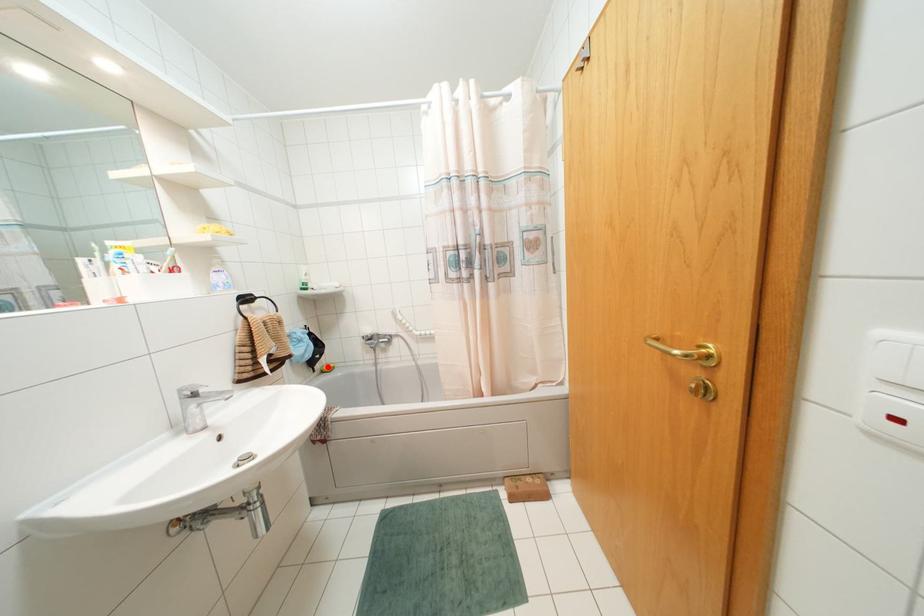
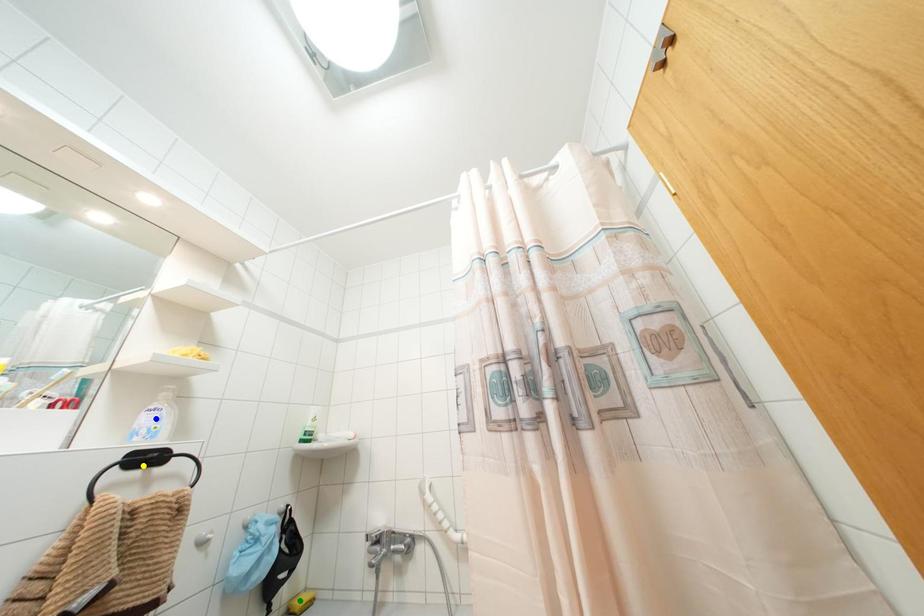
Question: I am providing you with two images of the same scene from different viewpoints. A red point is marked on the first image. You are given multiple points on the second image. Which spot in image 2 lines up with the point in image 1?

Choices:
 (A) yellow point
 (B) green point
 (C) blue point

Answer: (B)